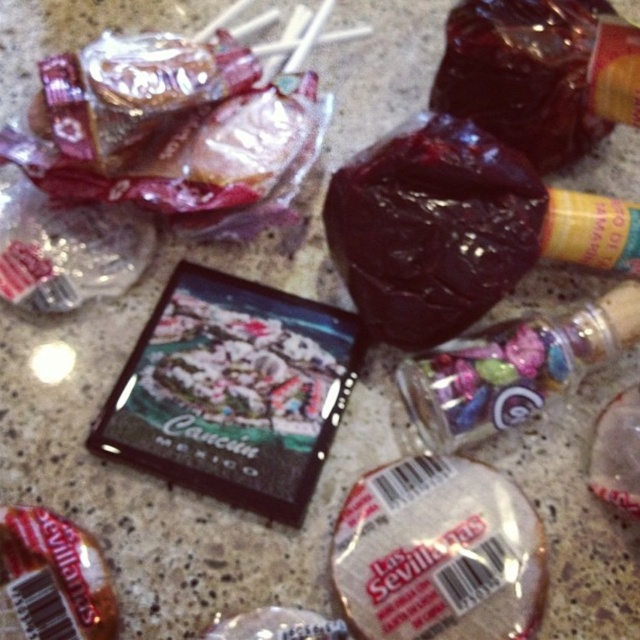
Does white matte cookie at center have a greater height compared to brown matte chocolate at center?

Correct, white matte cookie at center is much taller as brown matte chocolate at center.

Which is below, white matte cookie at center or brown matte chocolate at center?

brown matte chocolate at center is below.

Identify the location of white matte cookie at center. This screenshot has width=640, height=640. tap(438, 554).

Identify the location of white matte cookie at center. (438, 554).

Does shiny dark chocolate at center have a larger size compared to brown matte chocolate at center?

Yes.

Can you confirm if shiny dark chocolate at center is positioned to the right of brown matte chocolate at center?

Yes, shiny dark chocolate at center is to the right of brown matte chocolate at center.

Where is `shiny dark chocolate at center`? This screenshot has width=640, height=640. shiny dark chocolate at center is located at coordinates (433, 228).

Is shiny dark chocolate at center thinner than white matte cookie at center?

No, shiny dark chocolate at center is not thinner than white matte cookie at center.

Which is below, shiny dark chocolate at center or white matte cookie at center?

Positioned lower is white matte cookie at center.

Is point (422, 321) positioned before point (426, 561)?

No, it is behind (426, 561).

The width and height of the screenshot is (640, 640). In order to click on shiny dark chocolate at center in this screenshot , I will do `click(433, 228)`.